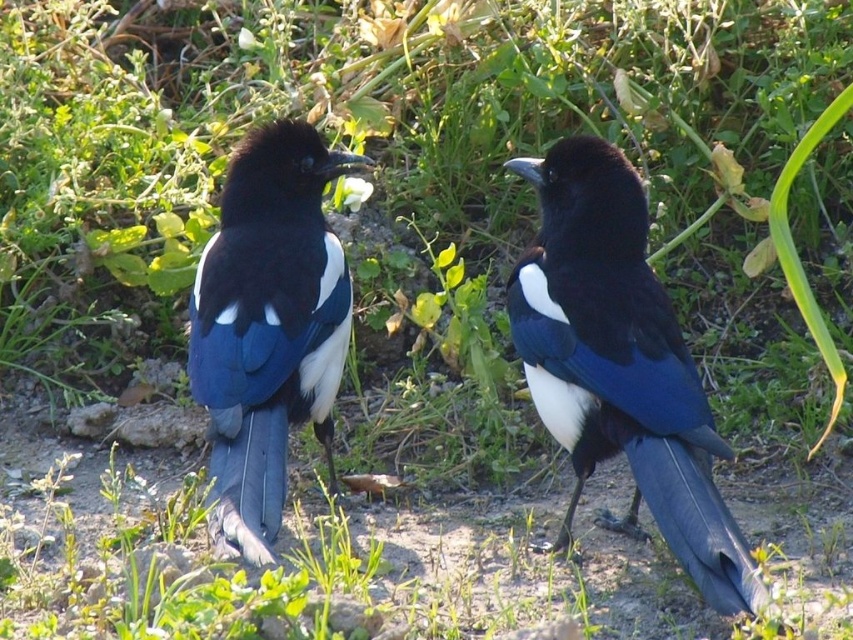
You are a photographer standing at a safe distance from the shiny black magpie at center. You want to capture a closeup shot without disturbing it. If your camera has a focal length of 300mm, what is the minimum distance you should be from the magpie to achieve a closeup?

The shiny black magpie at center is 6.97 feet away from the camera. Using a 300mm lens, this distance is sufficient for a closeup without needing to be closer, so you should maintain the 6.97 feet distance.

You are a photographer trying to capture a clear photo of the shiny blue magpie at center. However, the green leafy grass at center is blocking your view. Can you adjust your camera angle to see the magpie without the grass obstruction?

The green leafy grass at center is shorter than the shiny blue magpie at center, so you can adjust your camera angle upwards to see the magpie above the grass.

You are a photographer trying to capture the shiny black magpie at center while avoiding the green leafy grass at center in the foreground. Is the grass likely blocking the magpie in your shot?

The green leafy grass at center is located below the shiny black magpie at center, so the grass is not blocking the magpie in your shot.